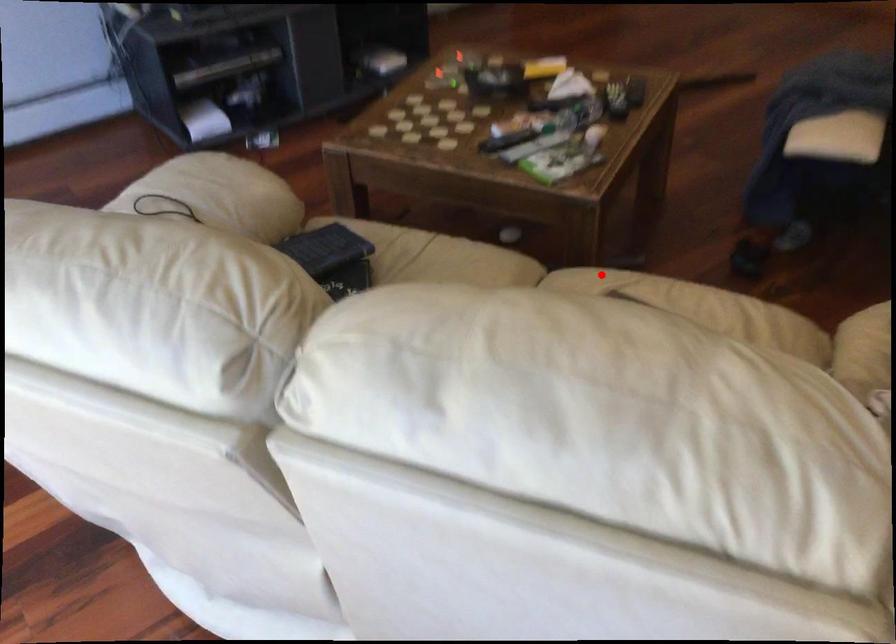
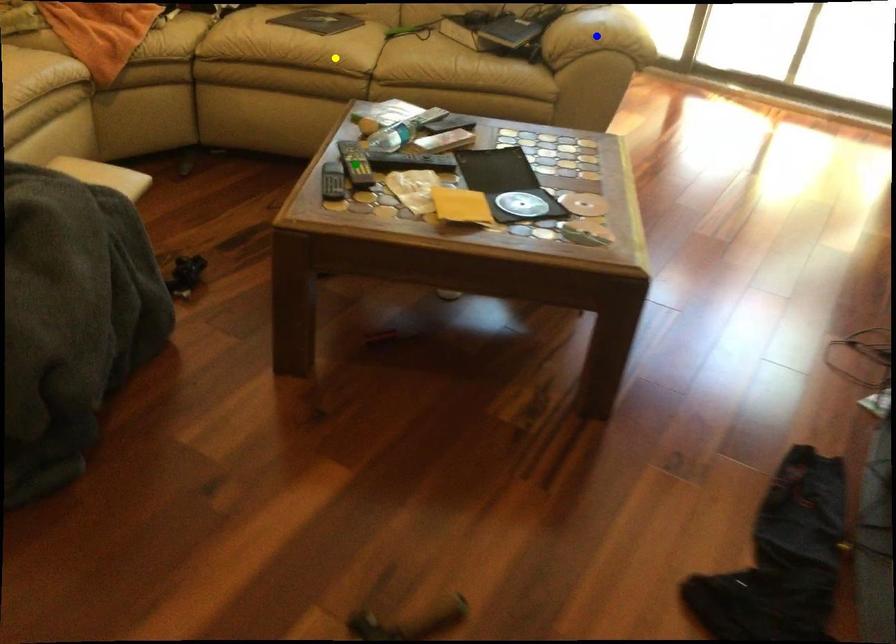
Question: I am providing you with two images of the same scene from different viewpoints. A red point is marked on the first image. You are given multiple points on the second image. Which point in image 2 is actually the same real-world point as the red point in image 1?

Choices:
 (A) green point
 (B) yellow point
 (C) blue point

Answer: (B)